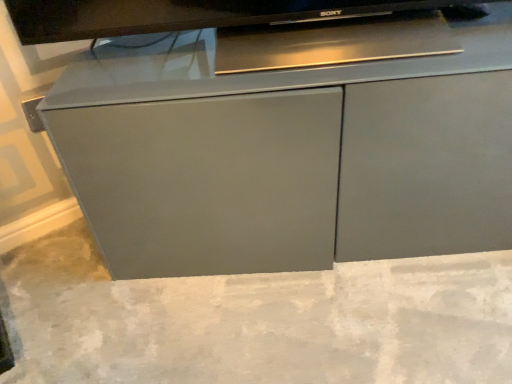
Locate an element on the screen. gray concrete at center is located at coordinates (258, 321).

Describe the element at coordinates (258, 321) in the screenshot. I see `gray concrete at center` at that location.

Image resolution: width=512 pixels, height=384 pixels. What are the coordinates of `matte gray cabinet at center` in the screenshot? It's located at (288, 156).

Describe the element at coordinates (288, 156) in the screenshot. I see `matte gray cabinet at center` at that location.

Image resolution: width=512 pixels, height=384 pixels. Identify the location of gray concrete at center. (258, 321).

Is gray concrete at center at the left side of matte gray cabinet at center?

Yes.

Which is in front, gray concrete at center or matte gray cabinet at center?

gray concrete at center is more forward.

Is point (325, 318) farther from viewer compared to point (340, 138)?

Yes, point (325, 318) is farther from viewer.

From the image's perspective, which one is positioned higher, gray concrete at center or matte gray cabinet at center?

From the image's view, matte gray cabinet at center is above.

From a real-world perspective, who is located lower, gray concrete at center or matte gray cabinet at center?

gray concrete at center.

Is gray concrete at center wider or thinner than matte gray cabinet at center?

gray concrete at center is wider than matte gray cabinet at center.

Can you confirm if gray concrete at center is taller than matte gray cabinet at center?

In fact, gray concrete at center may be shorter than matte gray cabinet at center.

Between gray concrete at center and matte gray cabinet at center, which one has smaller size?

With smaller size is gray concrete at center.

Which is correct: gray concrete at center is inside matte gray cabinet at center, or outside of it?

gray concrete at center exists outside the volume of matte gray cabinet at center.

Is gray concrete at center placed right next to matte gray cabinet at center?

gray concrete at center and matte gray cabinet at center are clearly separated.

Is gray concrete at center looking in the opposite direction of matte gray cabinet at center?

No, matte gray cabinet at center is not at the back of gray concrete at center.

Can you tell me how much gray concrete at center and matte gray cabinet at center differ in facing direction?

The angle between the facing direction of gray concrete at center and the facing direction of matte gray cabinet at center is 125 degrees.

Measure the distance from gray concrete at center to matte gray cabinet at center.

gray concrete at center is 9.37 inches away from matte gray cabinet at center.

You are a GUI agent. You are given a task and a screenshot of the screen. Output one action in this format:
    pyautogui.click(x=<x>, y=<y>)
    Task: Click on the concrete in front of the matte gray cabinet at center
    
    Given the screenshot: What is the action you would take?
    pyautogui.click(x=258, y=321)

Between matte gray cabinet at center and gray concrete at center, which one appears on the right side from the viewer's perspective?

matte gray cabinet at center is more to the right.

In the image, is matte gray cabinet at center positioned in front of or behind gray concrete at center?

matte gray cabinet at center is behind gray concrete at center.

Considering the positions of points (419, 227) and (479, 347), is point (419, 227) farther from camera compared to point (479, 347)?

Yes.

From the image's perspective, does matte gray cabinet at center appear lower than gray concrete at center?

No, from the image's perspective, matte gray cabinet at center is not below gray concrete at center.

From a real-world perspective, which object stands above the other?

matte gray cabinet at center is physically above.

Is matte gray cabinet at center thinner than gray concrete at center?

Yes, matte gray cabinet at center is thinner than gray concrete at center.

Does matte gray cabinet at center have a lesser height compared to gray concrete at center?

Incorrect, the height of matte gray cabinet at center does not fall short of that of gray concrete at center.

Looking at this image, looking at the image, does matte gray cabinet at center seem bigger or smaller compared to gray concrete at center?

matte gray cabinet at center is bigger than gray concrete at center.

Would you say gray concrete at center is part of matte gray cabinet at center's contents?

Actually, gray concrete at center is outside matte gray cabinet at center.

Is there a large distance between matte gray cabinet at center and gray concrete at center?

No, matte gray cabinet at center is not far away from gray concrete at center.

Could you tell me if matte gray cabinet at center is turned towards gray concrete at center?

No, matte gray cabinet at center is not turned towards gray concrete at center.

How different are the orientations of matte gray cabinet at center and gray concrete at center in degrees?

matte gray cabinet at center and gray concrete at center are facing 125 degrees away from each other.

The width and height of the screenshot is (512, 384). I want to click on concrete below the matte gray cabinet at center (from the image's perspective), so click(x=258, y=321).

The width and height of the screenshot is (512, 384). What are the coordinates of `cabinetry above the gray concrete at center (from a real-world perspective)` in the screenshot? It's located at (288, 156).

This screenshot has width=512, height=384. I want to click on concrete located underneath the matte gray cabinet at center (from a real-world perspective), so click(x=258, y=321).